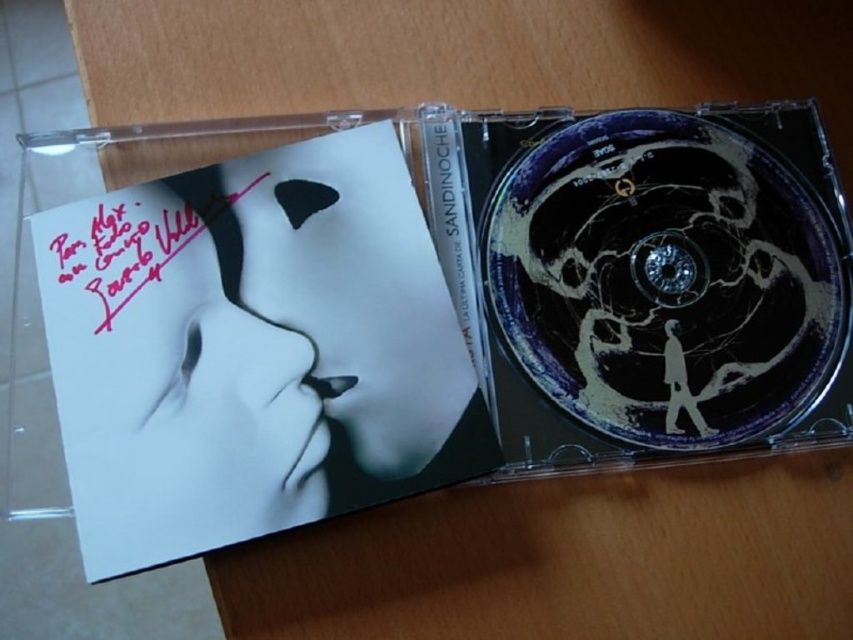
Can you confirm if pink ink signature at upper left is smaller than satin black text at center?

Incorrect, pink ink signature at upper left is not smaller in size than satin black text at center.

Is point (131, 268) closer to viewer compared to point (434, 220)?

That is True.

At what (x,y) coordinates should I click in order to perform the action: click on pink ink signature at upper left. Please return your answer as a coordinate pair (x, y). The width and height of the screenshot is (853, 640). Looking at the image, I should click on (138, 243).

Who is higher up, white matte mask at upper left or pink ink signature at upper left?

Positioned higher is pink ink signature at upper left.

Between white matte mask at upper left and pink ink signature at upper left, which one has less height?

With less height is pink ink signature at upper left.

Describe the element at coordinates (231, 346) in the screenshot. I see `white matte mask at upper left` at that location.

In order to click on white matte mask at upper left in this screenshot , I will do `click(231, 346)`.

Does white matte mask at upper left have a greater width compared to satin black text at center?

Yes, white matte mask at upper left is wider than satin black text at center.

Describe the element at coordinates (231, 346) in the screenshot. I see `white matte mask at upper left` at that location.

Is point (341, 371) positioned after point (469, 321)?

No, (341, 371) is in front of (469, 321).

You are a GUI agent. You are given a task and a screenshot of the screen. Output one action in this format:
    pyautogui.click(x=<x>, y=<y>)
    Task: Click on the white matte mask at upper left
    
    Given the screenshot: What is the action you would take?
    pyautogui.click(x=231, y=346)